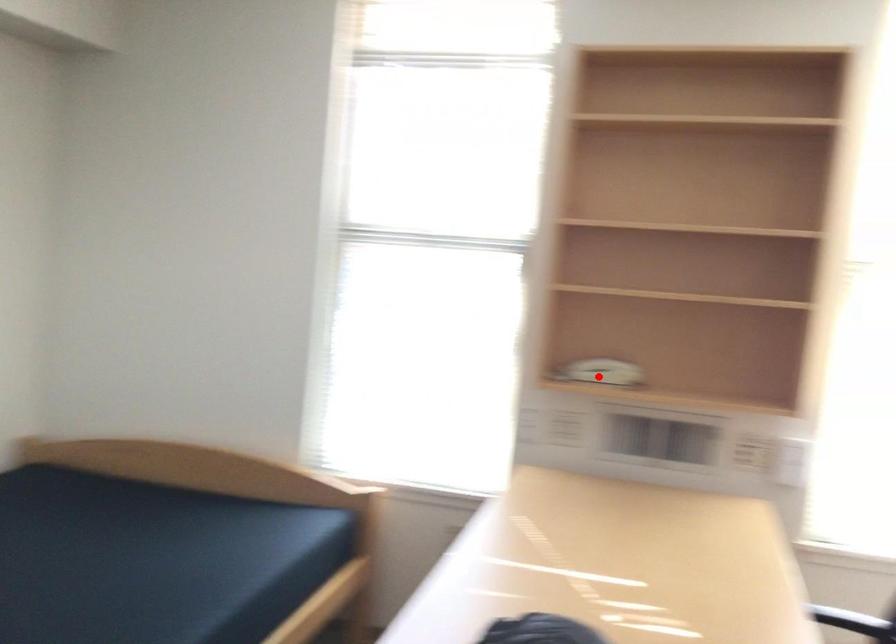
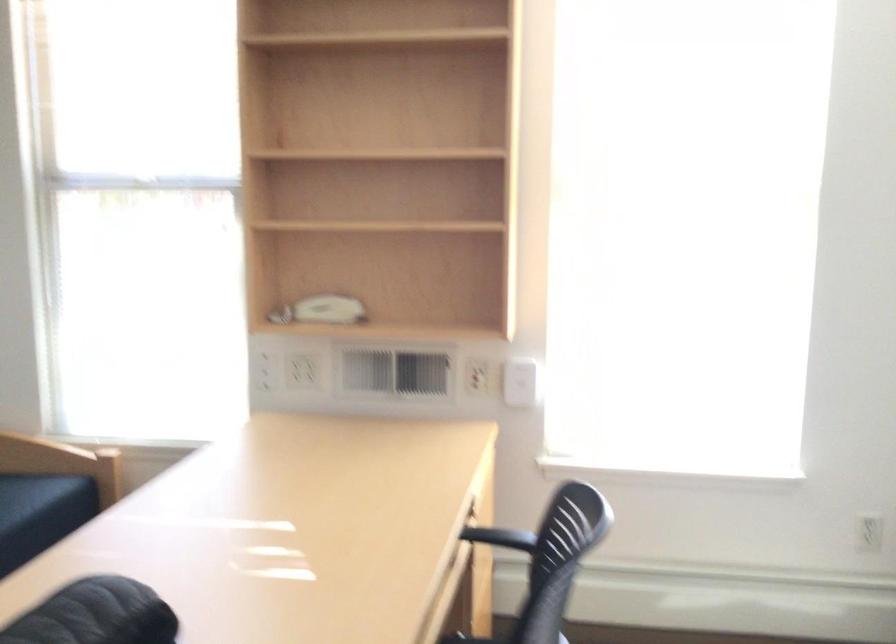
Locate, in the second image, the point that corresponds to the highlighted location in the first image.

(324, 314)